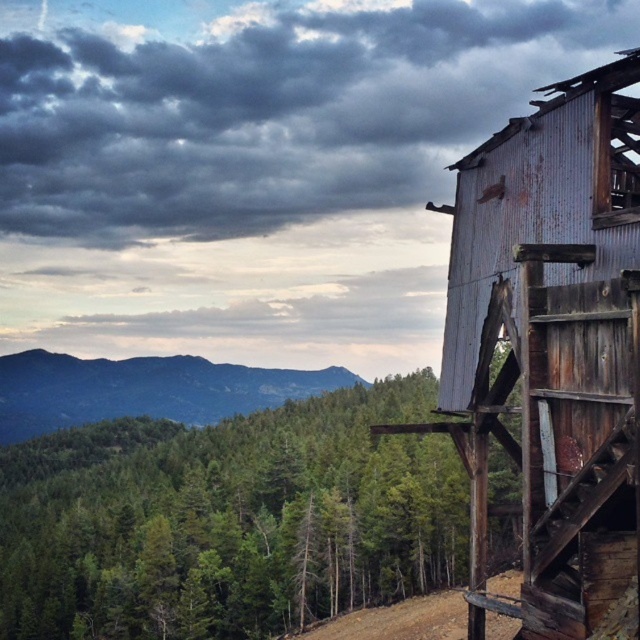
You are a hiker planning to take a photo of the green matte tree at center and the green forested mountain at upper left. Which object will appear smaller in your photo?

The green matte tree at center will appear smaller in your photo because it is thinner than the green forested mountain at upper left.

You are standing on the dirt path leading to the dilapidated structure. You notice a green matte tree at center and a green forested mountain at upper left. Which of these two objects is nearer to you?

The green matte tree at center is closer to the viewer than the green forested mountain at upper left.

You are a hiker with a 10 meter long rope. You want to secure your gear to the rusty corrugated metal hut at right using the brown dirt track at lower center as an anchor point. Is your rope long enough to reach from the anchor point to the hut?

The distance between the rusty corrugated metal hut at right and the brown dirt track at lower center is 11.83 meters. Since your rope is only 10 meters long, it is not long enough to reach from the anchor point to the hut.